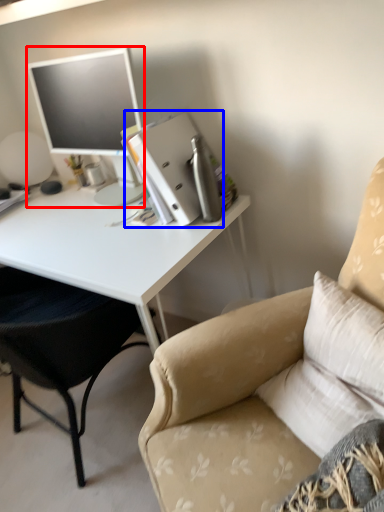
Question: Which of the following is the closest to the observer, television (highlighted by a red box) or binder (highlighted by a blue box)?

Choices:
 (A) television
 (B) binder

Answer: (A)